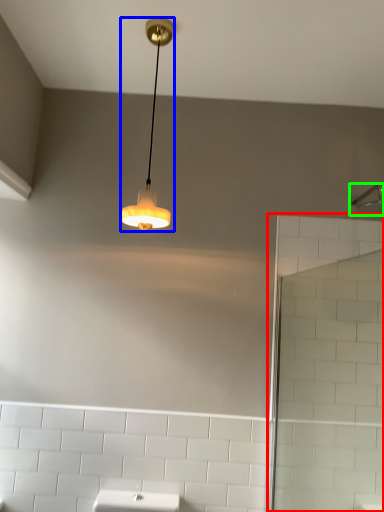
Question: Considering the real-world distances, which object is closest to screen door (highlighted by a red box)? lamp (highlighted by a blue box) or shower (highlighted by a green box).

Choices:
 (A) lamp
 (B) shower

Answer: (B)